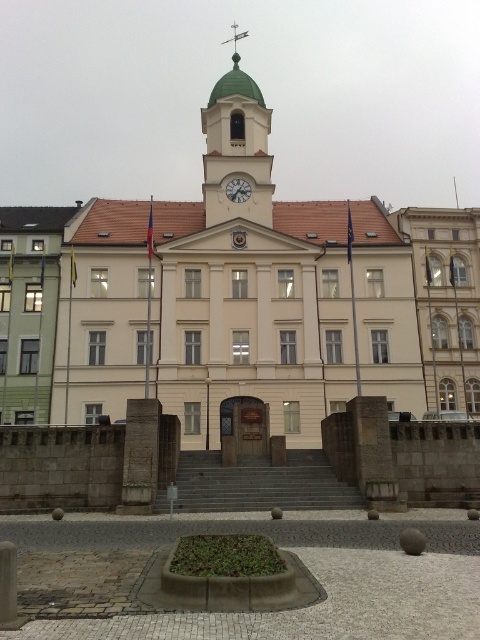
Question: Which point is closer to the camera taking this photo?

Choices:
 (A) (216, 218)
 (B) (232, 186)
 (C) (225, 483)

Answer: (C)

Question: Does green dome clock tower at center have a smaller size compared to metallic clock at center?

Choices:
 (A) yes
 (B) no

Answer: (B)

Question: Which point is farther to the camera?

Choices:
 (A) metallic clock at center
 (B) gray concrete stairs at center
 (C) white smooth building at center

Answer: (A)

Question: Is the position of white smooth building at center more distant than that of green dome clock tower at center?

Choices:
 (A) no
 (B) yes

Answer: (A)

Question: Is green dome clock tower at center in front of metallic clock at center?

Choices:
 (A) yes
 (B) no

Answer: (A)

Question: Among these points, which one is farthest from the camera?

Choices:
 (A) (242, 202)
 (B) (343, 257)
 (C) (224, 220)

Answer: (A)